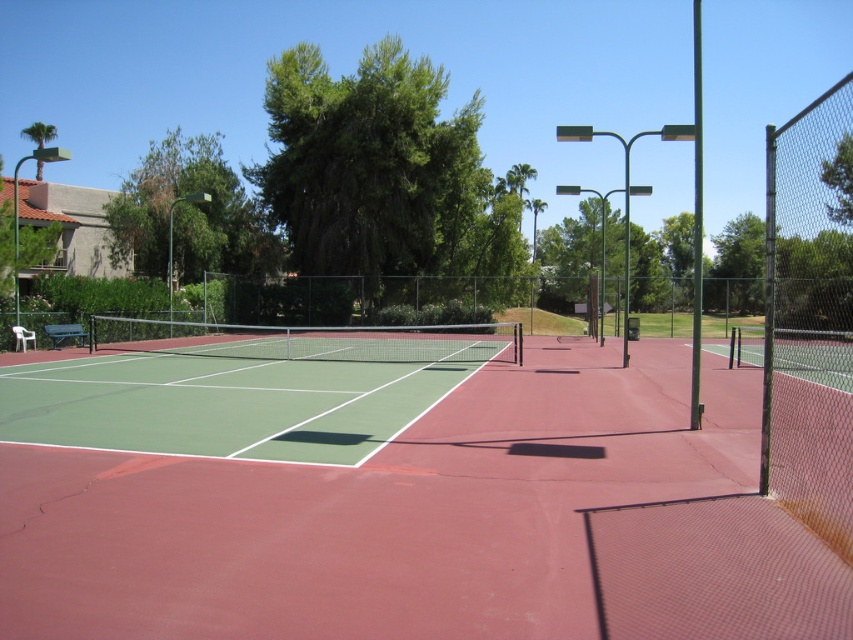
Question: Which point is farther from the camera taking this photo?

Choices:
 (A) (48, 129)
 (B) (621, 248)
 (C) (827, 164)

Answer: (B)

Question: From the image, what is the correct spatial relationship of green rubber tennis court at center in relation to green leafy tree at upper left?

Choices:
 (A) left
 (B) right

Answer: (B)

Question: Is green rubber tennis court at center to the left of green leafy tree at upper center from the viewer's perspective?

Choices:
 (A) no
 (B) yes

Answer: (B)

Question: Among these objects, which one is nearest to the camera?

Choices:
 (A) green leafy tree at upper center
 (B) green leafy tree at upper right
 (C) green rubber tennis court at center

Answer: (C)

Question: Which object is positioned farthest from the green leafy tree at upper center?

Choices:
 (A) green leafy tree at upper left
 (B) green leafy tree at upper right

Answer: (A)

Question: Considering the relative positions of green leafy tree at upper right and green leafy tree at upper left in the image provided, where is green leafy tree at upper right located with respect to green leafy tree at upper left?

Choices:
 (A) right
 (B) left

Answer: (A)